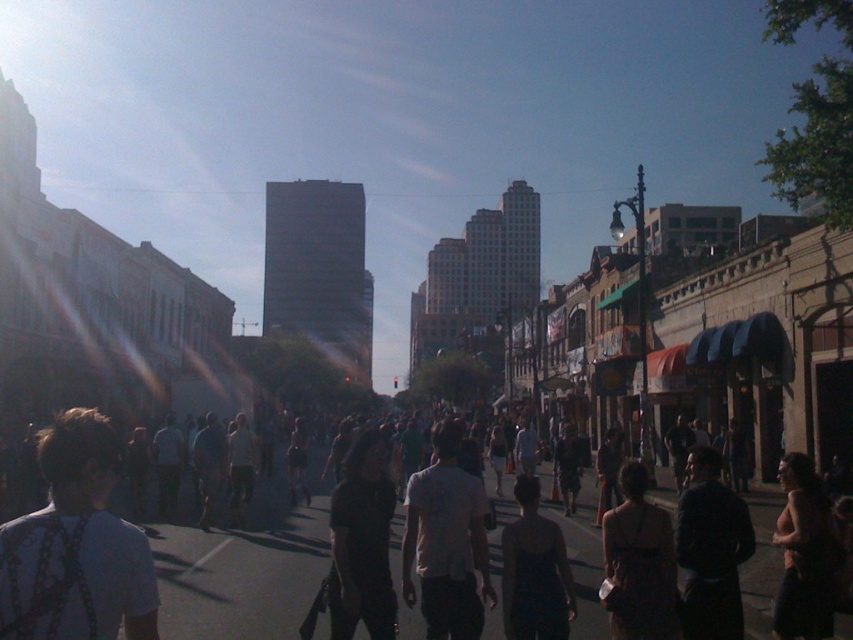
Question: Which point is closer to the camera?

Choices:
 (A) (503, 548)
 (B) (430, 488)
 (C) (113, 632)
 (D) (229, 580)

Answer: (C)

Question: Which point appears closest to the camera in this image?

Choices:
 (A) (367, 566)
 (B) (28, 596)

Answer: (B)

Question: Does dark gray clothing at center appear on the right side of white fabric bag at lower left?

Choices:
 (A) yes
 (B) no

Answer: (A)

Question: Considering the real-world distances, which object is closest to the white fabric bag at lower left?

Choices:
 (A) dark gray shirt at center
 (B) dark gray clothing at center

Answer: (A)

Question: Does white fabric bag at lower left appear over white matte shirt at center?

Choices:
 (A) yes
 (B) no

Answer: (A)

Question: Is dark gray clothing at center behind white matte shirt at center?

Choices:
 (A) no
 (B) yes

Answer: (A)